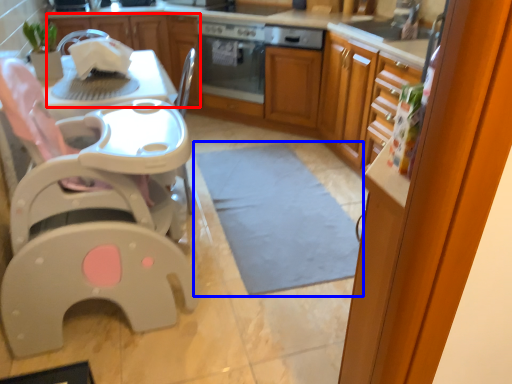
Question: Which point is closer to the camera, cabinetry (highlighted by a red box) or mat (highlighted by a blue box)?

Choices:
 (A) cabinetry
 (B) mat

Answer: (B)